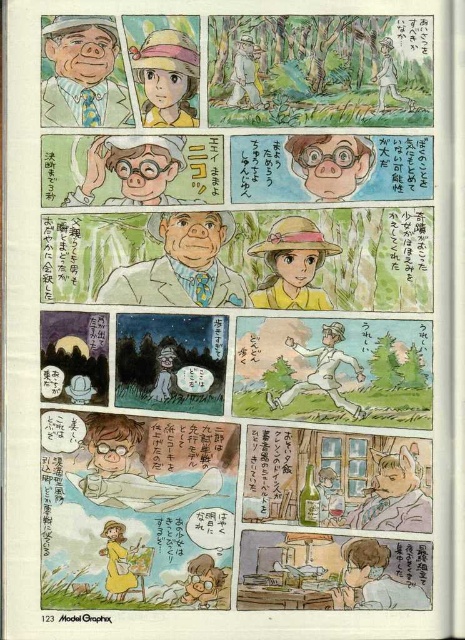
Question: Which object appears closest to the camera in this image?

Choices:
 (A) matte white pig at center
 (B) smooth brown hair at lower center
 (C) light brown wooden stick at upper right

Answer: (B)

Question: Which point is closer to the camera?

Choices:
 (A) yellow straw hat at center
 (B) yellow fabric dress at lower center
 (C) matte black hat at upper left

Answer: (B)

Question: Is matte black hat at upper left positioned in front of matte pink glasses at upper right?

Choices:
 (A) yes
 (B) no

Answer: (A)

Question: Considering the real-world distances, which object is farthest from the matte black hat at upper left?

Choices:
 (A) matte brown glasses at center
 (B) matte yellow hat at upper center

Answer: (A)

Question: Can you confirm if matte brown glasses at center is positioned to the left of yellow straw hat at center?

Choices:
 (A) yes
 (B) no

Answer: (A)

Question: Does yellow straw hat at center appear on the right side of light brown wooden stick at upper right?

Choices:
 (A) no
 (B) yes

Answer: (A)